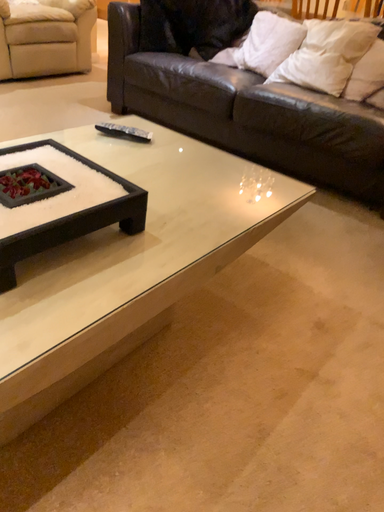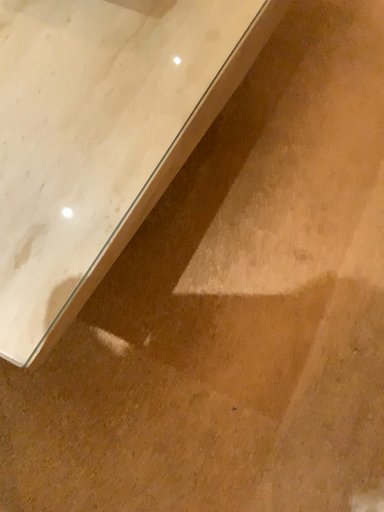
Question: Which way did the camera rotate in the video?

Choices:
 (A) rotated right
 (B) rotated left

Answer: (A)